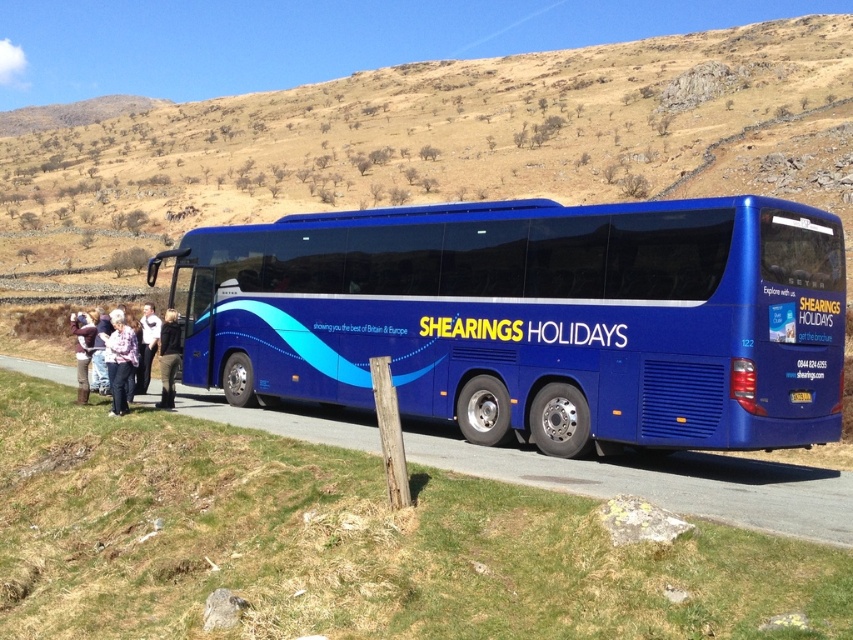
You are a traveler standing near the Shearings Holidays bus and looking at the weathered wood post at lower center and the light pink fabric pants at lower left. Which object is closer to the ground?

The weathered wood post at lower center is closer to the ground because it is positioned below the light pink fabric pants at lower left.

What are the coordinates of the blue metallic bus at center in the image?

The coordinates of the blue metallic bus at center are at point [534,317].

You are standing at the edge of the road where the large blue coach bus is parked. You see a brown grassy hillside at upper center and a plaid shirt at center. Which object is positioned to the left of the other?

The brown grassy hillside at upper center is to the left of plaid shirt at center.